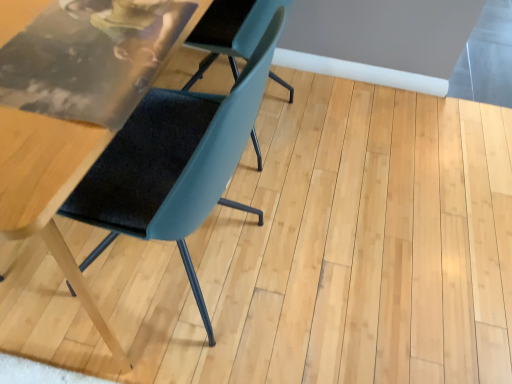
Question: Should I look upward or downward to see teal fabric chair at center, the 2th chair viewed from the right?

Choices:
 (A) up
 (B) down

Answer: (A)

Question: Can you confirm if teal fabric chair at center, which is counted as the first chair, starting from the left, is thinner than matte blue chair at center, positioned as the 1th chair in right-to-left order?

Choices:
 (A) no
 (B) yes

Answer: (A)

Question: Is teal fabric chair at center, the 2th chair viewed from the right, not within matte blue chair at center, which appears as the second chair when viewed from the left?

Choices:
 (A) yes
 (B) no

Answer: (A)

Question: Does teal fabric chair at center, which is counted as the first chair, starting from the left, have a greater height compared to matte blue chair at center, which appears as the second chair when viewed from the left?

Choices:
 (A) yes
 (B) no

Answer: (A)

Question: Can matte blue chair at center, which appears as the second chair when viewed from the left, be found inside teal fabric chair at center, which is counted as the first chair, starting from the left?

Choices:
 (A) yes
 (B) no

Answer: (A)

Question: Can you confirm if teal fabric chair at center, which is counted as the first chair, starting from the left, is shorter than matte blue chair at center, positioned as the 1th chair in right-to-left order?

Choices:
 (A) no
 (B) yes

Answer: (A)

Question: Can you confirm if teal fabric chair at center, which is counted as the first chair, starting from the left, is positioned to the left of matte blue chair at center, positioned as the 1th chair in right-to-left order?

Choices:
 (A) yes
 (B) no

Answer: (A)

Question: Is matte blue chair at center, which appears as the second chair when viewed from the left, in contact with teal fabric chair at center, which is counted as the first chair, starting from the left?

Choices:
 (A) yes
 (B) no

Answer: (B)

Question: Considering the relative sizes of matte blue chair at center, which appears as the second chair when viewed from the left, and teal fabric chair at center, which is counted as the first chair, starting from the left, in the image provided, is matte blue chair at center, which appears as the second chair when viewed from the left, thinner than teal fabric chair at center, which is counted as the first chair, starting from the left,?

Choices:
 (A) no
 (B) yes

Answer: (B)

Question: Considering the relative positions of matte blue chair at center, which appears as the second chair when viewed from the left, and teal fabric chair at center, the 2th chair viewed from the right, in the image provided, is matte blue chair at center, which appears as the second chair when viewed from the left, behind teal fabric chair at center, the 2th chair viewed from the right,?

Choices:
 (A) yes
 (B) no

Answer: (A)

Question: Does matte blue chair at center, positioned as the 1th chair in right-to-left order, have a lesser height compared to teal fabric chair at center, which is counted as the first chair, starting from the left?

Choices:
 (A) no
 (B) yes

Answer: (B)

Question: Does matte blue chair at center, positioned as the 1th chair in right-to-left order, appear on the right side of teal fabric chair at center, which is counted as the first chair, starting from the left?

Choices:
 (A) no
 (B) yes

Answer: (B)

Question: Is matte blue chair at center, which appears as the second chair when viewed from the left, positioned in front of teal fabric chair at center, which is counted as the first chair, starting from the left?

Choices:
 (A) yes
 (B) no

Answer: (B)

Question: Do you think matte blue chair at center, positioned as the 1th chair in right-to-left order, is within teal fabric chair at center, which is counted as the first chair, starting from the left, or outside of it?

Choices:
 (A) outside
 (B) inside

Answer: (B)